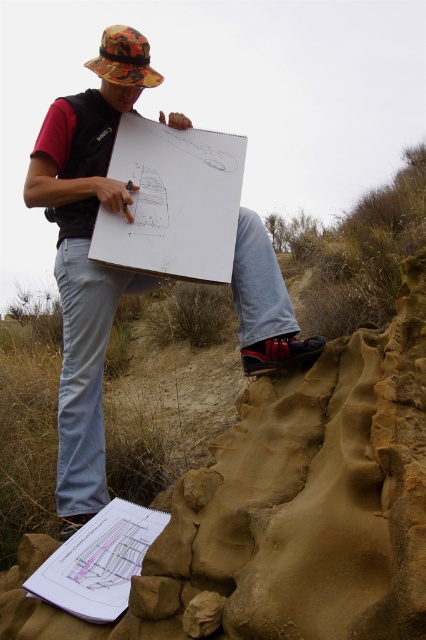
Question: Among these points, which one is nearest to the camera?

Choices:
 (A) (88, 381)
 (B) (135, 35)

Answer: (B)

Question: Does camouflage hat at upper left lie behind camouflage fabric hat at upper center?

Choices:
 (A) yes
 (B) no

Answer: (B)

Question: Which point is closer to the camera?

Choices:
 (A) (66, 344)
 (B) (138, 70)

Answer: (B)

Question: Which of the following is the farthest from the observer?

Choices:
 (A) (150, 83)
 (B) (126, 198)

Answer: (A)

Question: Can you confirm if camouflage hat at upper left is positioned below camouflage fabric hat at upper center?

Choices:
 (A) no
 (B) yes

Answer: (B)

Question: Can you confirm if camouflage hat at upper left is positioned to the right of camouflage fabric hat at upper center?

Choices:
 (A) yes
 (B) no

Answer: (A)